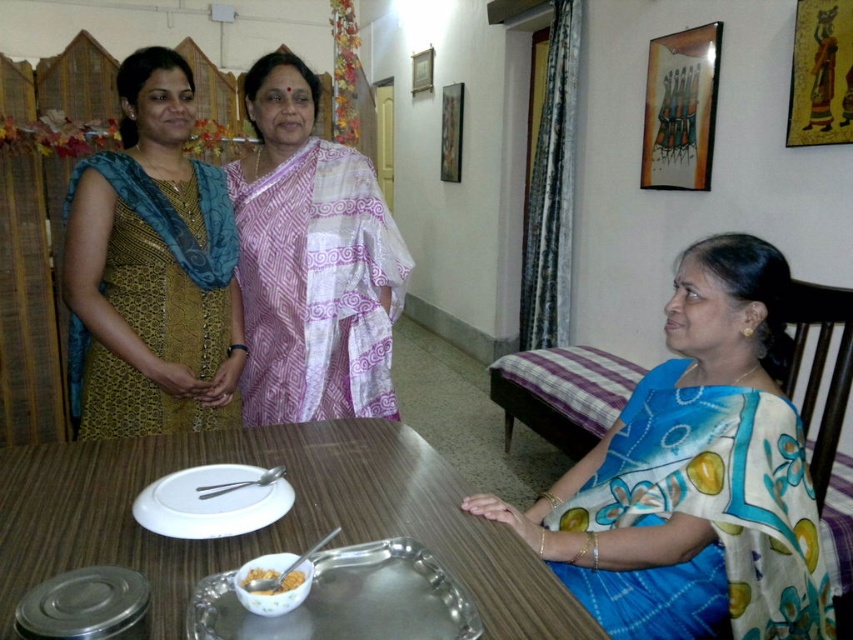
You are setting up a table for a small gathering and need to place the white matte plate at lower center and the white glossy bowl at lower center. According to the scene, which object should be placed to the left of the other?

The white matte plate at lower center should be placed to the left of the white glossy bowl at lower center as it is positioned on the left side of the bowl in the scene.

You are a guest at this gathering and want to place a small gift on the table without blocking the view of the matte gold dress at left. Where should you place it on the metallic silver tray at lower center?

Place the gift on the metallic silver tray at lower center towards the back edge so it doesn not block the view of the matte gold dress at left, since the tray is closer to you than the dress.